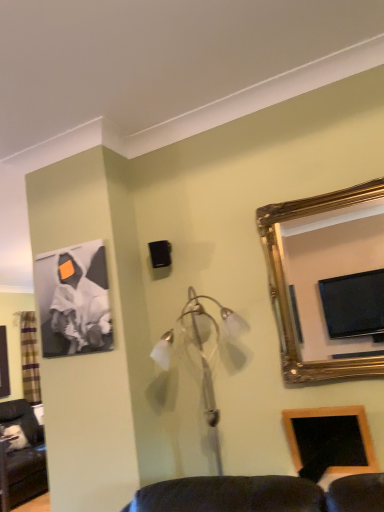
The image size is (384, 512). Describe the element at coordinates (331, 437) in the screenshot. I see `wooden picture frame at lower right, arranged as the 1th picture frame when viewed from the front` at that location.

In order to click on plaid fabric curtain at left in this screenshot , I will do `click(29, 357)`.

Considering the points (22, 311) and (61, 300), which point is behind, point (22, 311) or point (61, 300)?

The point (22, 311) is behind.

This screenshot has width=384, height=512. I want to click on curtain below the matte black canvas at upper left, the first picture frame positioned from the left (from the image's perspective), so click(x=29, y=357).

Considering the relative sizes of plaid fabric curtain at left and matte black canvas at upper left, arranged as the 1th picture frame when viewed from the back, in the image provided, is plaid fabric curtain at left taller than matte black canvas at upper left, arranged as the 1th picture frame when viewed from the back,?

Correct, plaid fabric curtain at left is much taller as matte black canvas at upper left, arranged as the 1th picture frame when viewed from the back.

Is plaid fabric curtain at left spatially inside matte black canvas at upper left, marked as the second picture frame in a right-to-left arrangement, or outside of it?

plaid fabric curtain at left is spatially situated outside matte black canvas at upper left, marked as the second picture frame in a right-to-left arrangement.

Can you tell me how much plaid fabric curtain at left and gold-framed mirror at upper right differ in facing direction?

92 degrees separate the facing orientations of plaid fabric curtain at left and gold-framed mirror at upper right.

Can gold-framed mirror at upper right be found inside plaid fabric curtain at left?

No, gold-framed mirror at upper right is not a part of plaid fabric curtain at left.

Is plaid fabric curtain at left bigger or smaller than gold-framed mirror at upper right?

In the image, plaid fabric curtain at left appears to be larger than gold-framed mirror at upper right.

Does plaid fabric curtain at left appear on the left side of gold-framed mirror at upper right?

Correct, you'll find plaid fabric curtain at left to the left of gold-framed mirror at upper right.

In terms of height, does wooden picture frame at lower right, which is the 1th picture frame in right-to-left order, look taller or shorter compared to gold-framed mirror at upper right?

Clearly, wooden picture frame at lower right, which is the 1th picture frame in right-to-left order, is shorter compared to gold-framed mirror at upper right.

From a real-world perspective, which object rests below the other?

wooden picture frame at lower right, the 2th picture frame from the back.

Is wooden picture frame at lower right, which is the 1th picture frame in right-to-left order, oriented towards gold-framed mirror at upper right?

No, wooden picture frame at lower right, which is the 1th picture frame in right-to-left order, is not turned towards gold-framed mirror at upper right.

Image resolution: width=384 pixels, height=512 pixels. What are the coordinates of `picture frame that is the 2nd one when counting downward from the gold-framed mirror at upper right (from the image's perspective)` in the screenshot? It's located at (331, 437).

Considering the relative sizes of wooden picture frame at lower right, arranged as the 1th picture frame when viewed from the front, and plaid fabric curtain at left in the image provided, is wooden picture frame at lower right, arranged as the 1th picture frame when viewed from the front, thinner than plaid fabric curtain at left?

Indeed, wooden picture frame at lower right, arranged as the 1th picture frame when viewed from the front, has a lesser width compared to plaid fabric curtain at left.

Is wooden picture frame at lower right, the first picture frame from the bottom, turned away from plaid fabric curtain at left?

No, wooden picture frame at lower right, the first picture frame from the bottom, is not facing away from plaid fabric curtain at left.

Is wooden picture frame at lower right, which is the 1th picture frame in right-to-left order, further to the viewer compared to plaid fabric curtain at left?

No, the depth of wooden picture frame at lower right, which is the 1th picture frame in right-to-left order, is less than that of plaid fabric curtain at left.

Is point (307, 429) closer or farther from the camera than point (33, 367)?

Point (307, 429) appears to be closer to the viewer than point (33, 367).

Consider the image. Between gold-framed mirror at upper right and wooden picture frame at lower right, which appears as the second picture frame when viewed from the top, which one has smaller width?

wooden picture frame at lower right, which appears as the second picture frame when viewed from the top.

Considering the relative positions of gold-framed mirror at upper right and wooden picture frame at lower right, arranged as the 1th picture frame when viewed from the front, in the image provided, is gold-framed mirror at upper right to the right of wooden picture frame at lower right, arranged as the 1th picture frame when viewed from the front, from the viewer's perspective?

Yes, gold-framed mirror at upper right is to the right of wooden picture frame at lower right, arranged as the 1th picture frame when viewed from the front.

Is gold-framed mirror at upper right outside of wooden picture frame at lower right, which is the 1th picture frame in right-to-left order?

gold-framed mirror at upper right lies outside wooden picture frame at lower right, which is the 1th picture frame in right-to-left order,'s area.

Image resolution: width=384 pixels, height=512 pixels. I want to click on curtain below the gold-framed mirror at upper right (from a real-world perspective), so click(29, 357).

Is gold-framed mirror at upper right oriented away from plaid fabric curtain at left?

No, plaid fabric curtain at left is not at the back of gold-framed mirror at upper right.

From the image's perspective, which one is positioned higher, gold-framed mirror at upper right or plaid fabric curtain at left?

gold-framed mirror at upper right.

Considering the sizes of objects wooden picture frame at lower right, which is the 1th picture frame in right-to-left order, and matte black canvas at upper left, the 2th picture frame positioned from the bottom, in the image provided, who is wider, wooden picture frame at lower right, which is the 1th picture frame in right-to-left order, or matte black canvas at upper left, the 2th picture frame positioned from the bottom,?

wooden picture frame at lower right, which is the 1th picture frame in right-to-left order, is wider.

This screenshot has width=384, height=512. In the image, there is a matte black canvas at upper left, arranged as the 1th picture frame when viewed from the back. In order to click on picture frame below it (from the image's perspective) in this screenshot , I will do `click(331, 437)`.

In the scene shown: Is wooden picture frame at lower right, arranged as the 1th picture frame when viewed from the front, not near matte black canvas at upper left, marked as the second picture frame in a right-to-left arrangement?

Yes, wooden picture frame at lower right, arranged as the 1th picture frame when viewed from the front, and matte black canvas at upper left, marked as the second picture frame in a right-to-left arrangement, are quite far apart.

Is matte black canvas at upper left, which appears as the first picture frame when viewed from the top, located within wooden picture frame at lower right, the first picture frame from the bottom?

Definitely not — matte black canvas at upper left, which appears as the first picture frame when viewed from the top, is not inside wooden picture frame at lower right, the first picture frame from the bottom.

Locate an element on the screen. curtain below the matte black canvas at upper left, arranged as the 1th picture frame when viewed from the back (from the image's perspective) is located at coordinates (29, 357).

Locate an element on the screen. curtain below the gold-framed mirror at upper right (from a real-world perspective) is located at coordinates (29, 357).

Which object lies further to the anchor point wooden picture frame at lower right, which appears as the second picture frame when viewed from the left, plaid fabric curtain at left or matte black canvas at upper left, the first picture frame positioned from the left?

plaid fabric curtain at left.

From the image, which object appears to be nearer to wooden picture frame at lower right, which is the 1th picture frame in right-to-left order, plaid fabric curtain at left or gold-framed mirror at upper right?

gold-framed mirror at upper right lies closer to wooden picture frame at lower right, which is the 1th picture frame in right-to-left order, than the other object.

Estimate the real-world distances between objects in this image. Which object is further from matte black canvas at upper left, marked as the second picture frame in a right-to-left arrangement, plaid fabric curtain at left or wooden picture frame at lower right, the first picture frame from the bottom?

Among the two, plaid fabric curtain at left is located further to matte black canvas at upper left, marked as the second picture frame in a right-to-left arrangement.

From the image, which object appears to be nearer to wooden picture frame at lower right, which appears as the second picture frame when viewed from the left, matte black canvas at upper left, the first picture frame positioned from the left, or plaid fabric curtain at left?

The object closer to wooden picture frame at lower right, which appears as the second picture frame when viewed from the left, is matte black canvas at upper left, the first picture frame positioned from the left.

When comparing their distances from plaid fabric curtain at left, does matte black canvas at upper left, which ranks as the 2th picture frame in front-to-back order, or wooden picture frame at lower right, which appears as the second picture frame when viewed from the top, seem further?

The object further to plaid fabric curtain at left is wooden picture frame at lower right, which appears as the second picture frame when viewed from the top.

Consider the image. Which object lies nearer to the anchor point gold-framed mirror at upper right, matte black canvas at upper left, arranged as the 1th picture frame when viewed from the back, or wooden picture frame at lower right, the 2th picture frame from the back?

wooden picture frame at lower right, the 2th picture frame from the back.

When comparing their distances from matte black canvas at upper left, arranged as the 1th picture frame when viewed from the back, does plaid fabric curtain at left or gold-framed mirror at upper right seem closer?

gold-framed mirror at upper right is positioned closer to the anchor matte black canvas at upper left, arranged as the 1th picture frame when viewed from the back.

When comparing their distances from plaid fabric curtain at left, does gold-framed mirror at upper right or wooden picture frame at lower right, which is the 1th picture frame in right-to-left order, seem closer?

wooden picture frame at lower right, which is the 1th picture frame in right-to-left order, is positioned closer to the anchor plaid fabric curtain at left.

Image resolution: width=384 pixels, height=512 pixels. What are the coordinates of `picture frame between wooden picture frame at lower right, the 2th picture frame from the back, and plaid fabric curtain at left, along the z-axis` in the screenshot? It's located at (74, 300).

At what (x,y) coordinates should I click in order to perform the action: click on picture frame between matte black canvas at upper left, marked as the second picture frame in a right-to-left arrangement, and gold-framed mirror at upper right, in the horizontal direction. Please return your answer as a coordinate pair (x, y). Looking at the image, I should click on (331, 437).